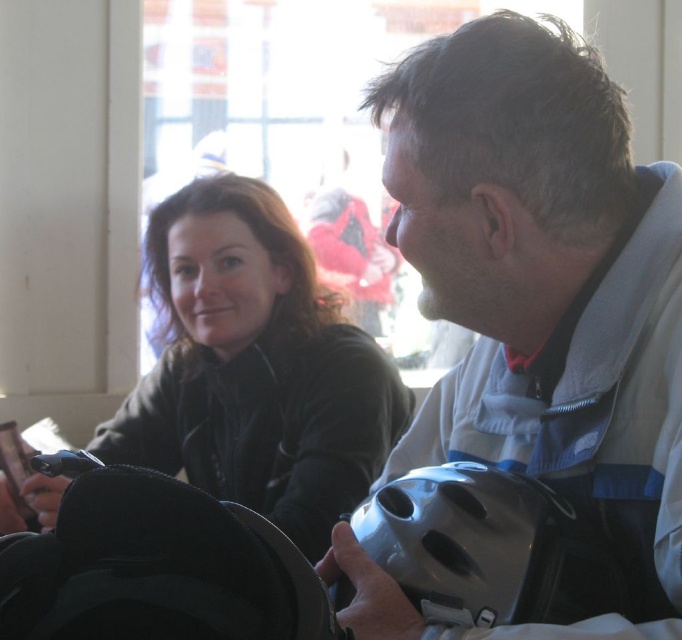
Is metallic gray helmet at center taller than black fabric helmet at lower left?

Correct, metallic gray helmet at center is much taller as black fabric helmet at lower left.

Is point (607, 220) less distant than point (85, 506)?

No, (607, 220) is behind (85, 506).

The width and height of the screenshot is (682, 640). In order to click on metallic gray helmet at center in this screenshot , I will do `click(535, 304)`.

Between point (291, 410) and point (443, 544), which one is positioned in front?

Point (443, 544)

Is point (276, 307) less distant than point (488, 598)?

No, (276, 307) is further to viewer.

Identify the location of matte black jacket at center. (256, 368).

Can you confirm if matte black jacket at center is shorter than black fabric helmet at lower left?

No, matte black jacket at center is not shorter than black fabric helmet at lower left.

Who is more forward, (323, 403) or (177, 573)?

Point (177, 573)

Locate an element on the screen. The height and width of the screenshot is (640, 682). matte black jacket at center is located at coordinates (256, 368).